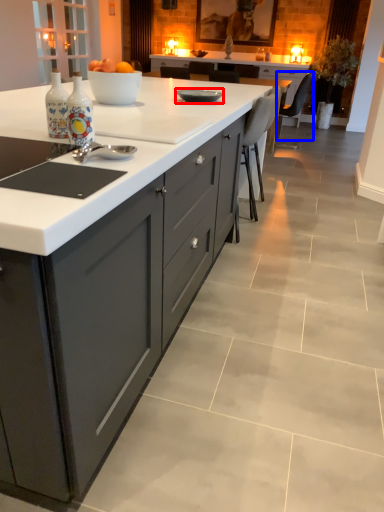
Question: Which point is further to the camera, kitchen appliance (highlighted by a red box) or chair (highlighted by a blue box)?

Choices:
 (A) kitchen appliance
 (B) chair

Answer: (B)